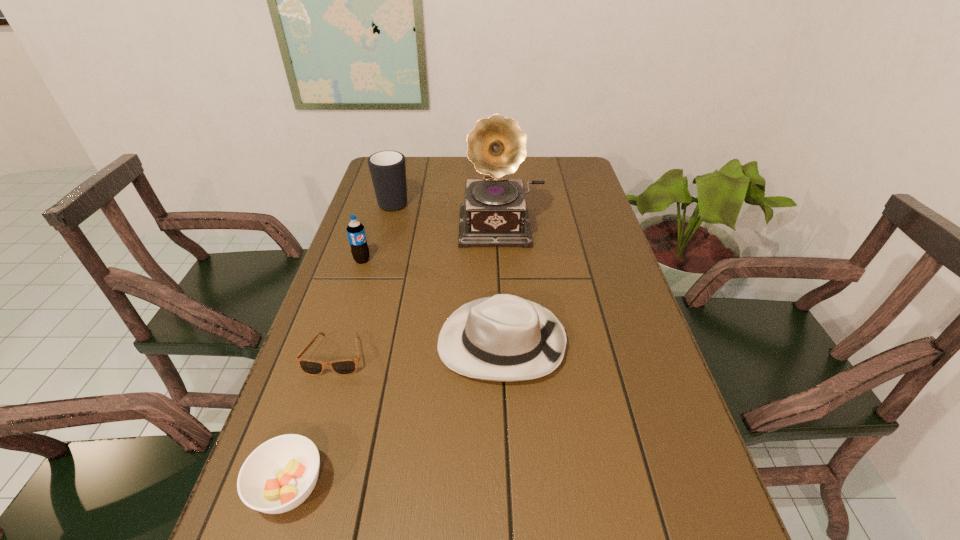
This screenshot has width=960, height=540. In order to click on sunglasses at the left edge in this screenshot , I will do `click(348, 366)`.

This screenshot has width=960, height=540. In the image, there is a desktop. In order to click on vacant space at the far edge in this screenshot , I will do `click(526, 187)`.

At what (x,y) coordinates should I click in order to perform the action: click on vacant space at the left edge. Please return your answer as a coordinate pair (x, y). Looking at the image, I should click on (395, 262).

Where is `free region at the right edge of the desktop`? free region at the right edge of the desktop is located at coordinates (639, 346).

This screenshot has height=540, width=960. In order to click on free space at the far left corner of the desktop in this screenshot , I will do `click(409, 170)`.

Where is `vacant space at the far right corner of the desktop`? The height and width of the screenshot is (540, 960). vacant space at the far right corner of the desktop is located at coordinates [551, 179].

This screenshot has height=540, width=960. I want to click on vacant space that's between the third shortest object and the fifth tallest object, so click(396, 415).

You are a GUI agent. You are given a task and a screenshot of the screen. Output one action in this format:
    pyautogui.click(x=<x>, y=<y>)
    Task: Click on the free spot between the soda bottle and the record player
    
    Given the screenshot: What is the action you would take?
    pyautogui.click(x=432, y=243)

Locate an element on the screen. The height and width of the screenshot is (540, 960). vacant region between the soup bowl and the third shortest object is located at coordinates (396, 415).

Locate an element on the screen. The width and height of the screenshot is (960, 540). blank region between the soup bowl and the record player is located at coordinates (396, 356).